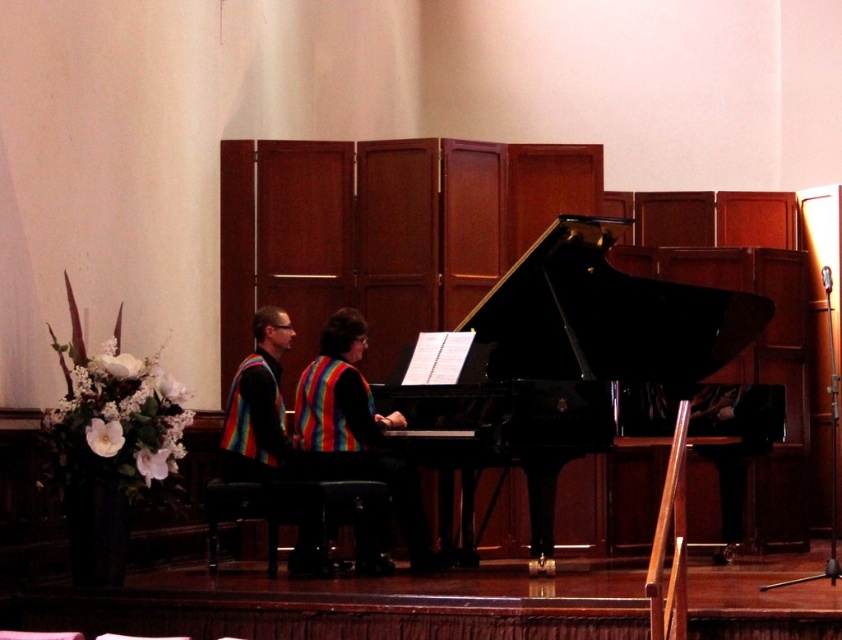
Question: Can you confirm if rainbow striped vest at center is wider than rainbow fabric vest at center?

Choices:
 (A) no
 (B) yes

Answer: (B)

Question: Which object is the farthest from the rainbow fabric vest at center?

Choices:
 (A) black polished piano at center
 (B) rainbow striped vest at center

Answer: (A)

Question: Is black polished piano at center to the right of rainbow fabric vest at center from the viewer's perspective?

Choices:
 (A) yes
 (B) no

Answer: (A)

Question: Is black polished piano at center to the left of rainbow fabric vest at center from the viewer's perspective?

Choices:
 (A) no
 (B) yes

Answer: (A)

Question: Which of the following is the farthest from the observer?

Choices:
 (A) (505, 336)
 (B) (236, 468)
 (C) (339, 355)

Answer: (A)

Question: Which object is the farthest from the rainbow fabric vest at center?

Choices:
 (A) rainbow striped vest at center
 (B) black polished piano at center

Answer: (B)